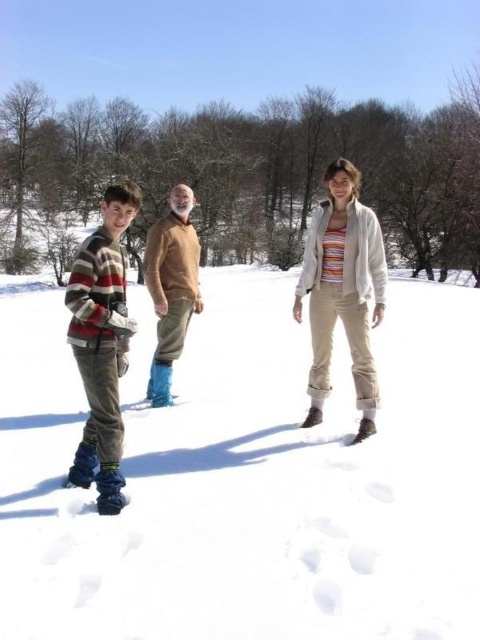
You are a photographer taking a picture of the striped sweater at center and the brown fuzzy sweater at center. Which sweater should you adjust to the left to make them both centered in the frame?

The striped sweater at center is positioned on the right side of brown fuzzy sweater at center, so you should move the striped sweater at center to the left to center them both in the frame.

Based on the scene description, which striped sweater is shorter in height between the striped sweater at center and the striped wool sweater at left?

The striped sweater at center has a lesser height compared to the striped wool sweater at left.